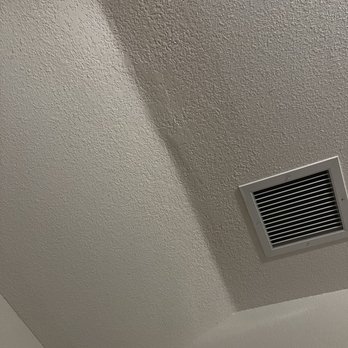
The image size is (348, 348). Find the location of `white textured ceiling`. white textured ceiling is located at coordinates pos(256,95).